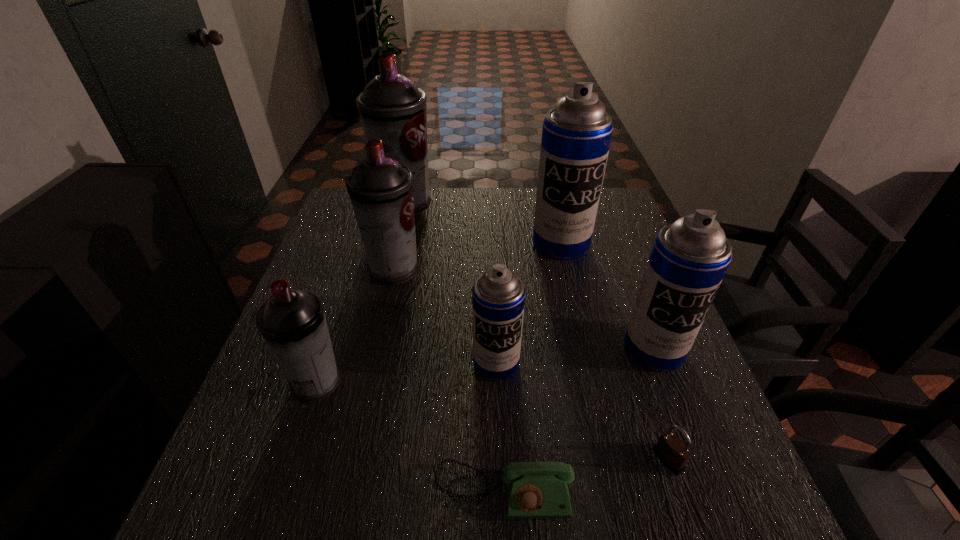
Where is `free area in between the second biggest gray aerosol can and the smallest blue aerosol can`? The width and height of the screenshot is (960, 540). free area in between the second biggest gray aerosol can and the smallest blue aerosol can is located at coordinates (444, 316).

The width and height of the screenshot is (960, 540). In order to click on free area in between the second smallest gray aerosol can and the telephone in this screenshot , I will do `click(448, 381)`.

Where is `free point between the leftmost blue aerosol can and the seventh tallest object`? Image resolution: width=960 pixels, height=540 pixels. free point between the leftmost blue aerosol can and the seventh tallest object is located at coordinates (582, 411).

What are the coordinates of `vacant space that is in between the telephone and the farthest object` in the screenshot? It's located at (454, 348).

This screenshot has width=960, height=540. I want to click on empty space between the telephone and the smallest blue aerosol can, so click(500, 427).

Identify the location of vacant space that's between the biggest gray aerosol can and the biggest blue aerosol can. (483, 224).

The image size is (960, 540). In order to click on vacant space that's between the second aerosol can from right to left and the smallest gray aerosol can in this screenshot , I will do `click(439, 313)`.

The height and width of the screenshot is (540, 960). Find the location of `the sixth closest object relative to the nearest gray aerosol can`. the sixth closest object relative to the nearest gray aerosol can is located at coordinates (671, 451).

The width and height of the screenshot is (960, 540). Identify the location of object identified as the fourth closest to the rightmost blue aerosol can. (534, 490).

Point out which aerosol can is positioned as the nearest to the shortest object. Please provide its 2D coordinates. Your answer should be formatted as a tuple, i.e. [(x, y)], where the tuple contains the x and y coordinates of a point satisfying the conditions above.

[(498, 296)]